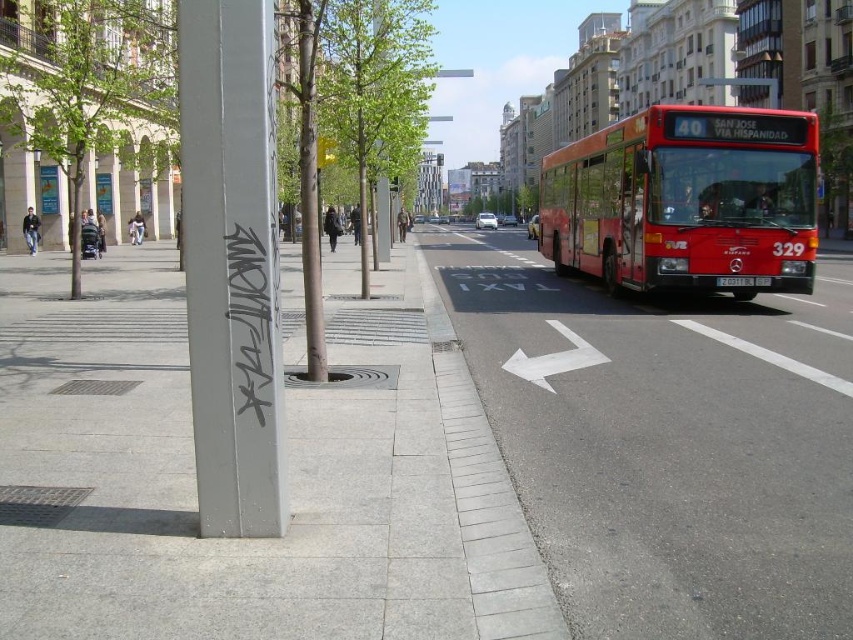
Question: Is gray concrete sidewalk at lower left below green leafy tree at left?

Choices:
 (A) no
 (B) yes

Answer: (B)

Question: Based on their relative distances, which object is nearer to the gray concrete curb at lower center?

Choices:
 (A) green leafy tree at left
 (B) gray concrete sidewalk at lower left
 (C) gray concrete sidewalk at center
 (D) red matte bus at right

Answer: (B)

Question: Does red matte bus at right have a larger size compared to green leafy tree at left?

Choices:
 (A) no
 (B) yes

Answer: (B)

Question: Is gray concrete sidewalk at center positioned behind metallic pole at left?

Choices:
 (A) yes
 (B) no

Answer: (B)

Question: Which object is the farthest from the red matte bus at right?

Choices:
 (A) gray concrete sidewalk at lower left
 (B) green leafy tree at center

Answer: (B)

Question: Which object is farther from the camera taking this photo?

Choices:
 (A) green leafy tree at center
 (B) gray concrete curb at lower center
 (C) gray concrete sidewalk at lower left
 (D) red matte bus at right

Answer: (A)